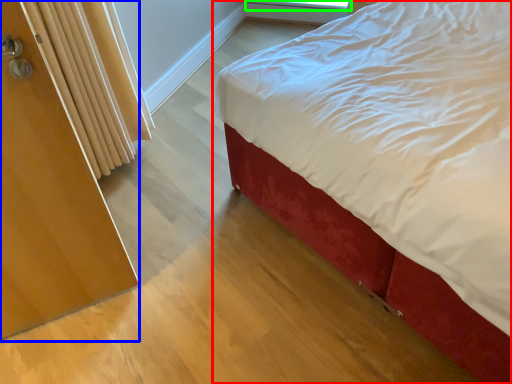
Question: Based on their relative distances, which object is farther from bed (highlighted by a red box)? Choose from screen door (highlighted by a blue box) and window screen (highlighted by a green box).

Choices:
 (A) screen door
 (B) window screen

Answer: (B)